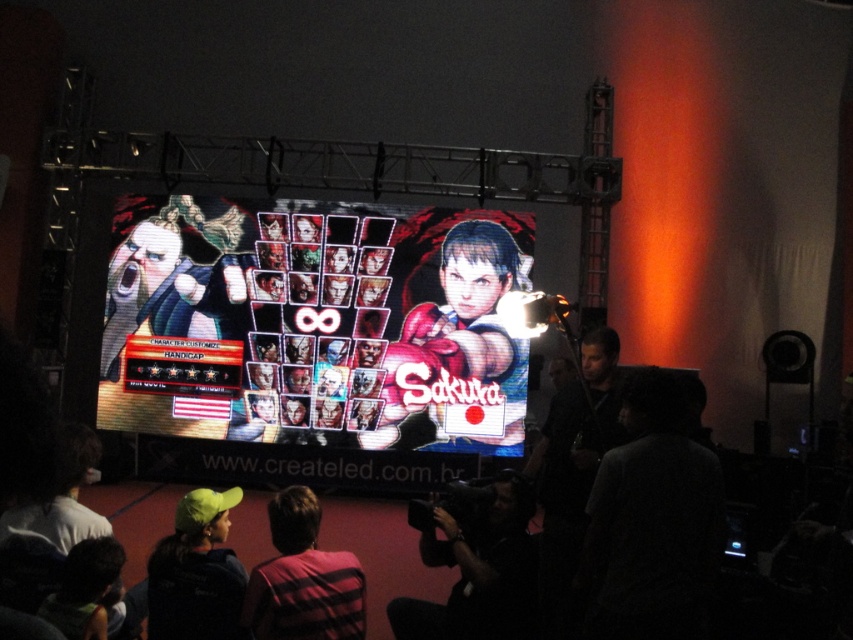
You are a photographer at the gaming event and need to position your equipment. You have a dark gray fabric camera at lower center and a plaid shirt at lower center. Which object is located more to the right?

The dark gray fabric camera at lower center is to the right of the plaid shirt at lower center, so the camera is more to the right.

You are setting up for a live stream and need to position the dark gray fabric at lower right and the dark gray fabric camera at lower center. Which object has a wider width?

The dark gray fabric camera at lower center has a wider width than the dark gray fabric at lower right.

You are a photographer at the event and need to adjust your camera to capture the pixelated digital display at center. Since you can only look through the viewfinder of the dark gray fabric camera at lower center, which direction should you move your camera to align it with the display?

The pixelated digital display at center is to the left of the dark gray fabric camera at lower center. Therefore, you should move the dark gray fabric camera at lower center to the right to align it with the pixelated digital display at center.